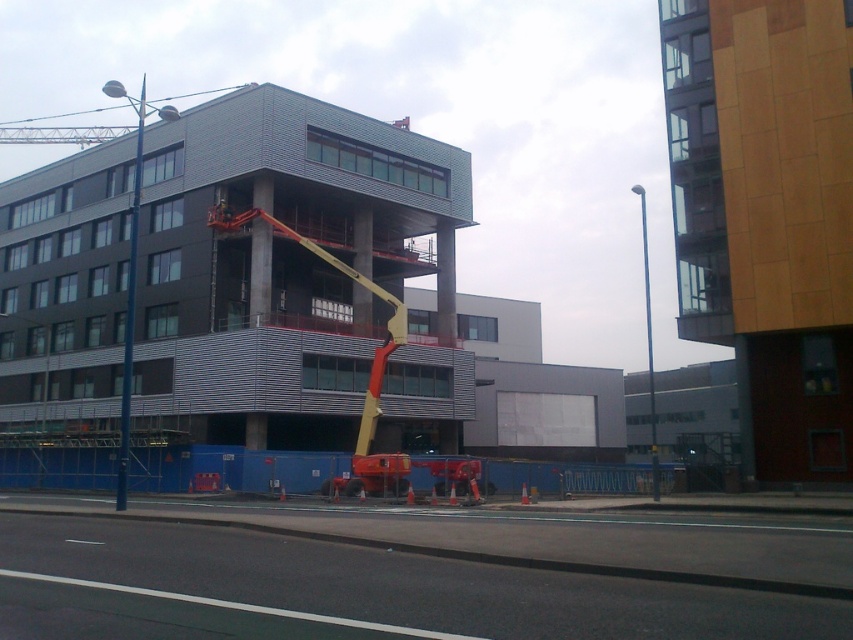
You are a delivery person approaching the construction site. You need to navigate around the orange traffic cones. There are two points marked on the map as point 1 at coordinates (138, 128) and point 2 at coordinates (119, 129). Which point should you avoid to stay safe and follow the path designated by the cones?

You should avoid point 2 at coordinates (119, 129) because point 1 at coordinates (138, 128) is in front of it, indicating that the path is blocked beyond point 2.

You are a delivery person trying to navigate through the construction site. You need to pass between the blue metallic pole at left and the metallic yellow crane at upper center. Can your 1.2 meter wide delivery cart fit through the space between them?

The blue metallic pole at left is narrower than the metallic yellow crane at upper center, but the question is about the space between them. Since the description only states their widths relative to each other, not the distance between them, we cannot determine if the 1.2 meter wide cart can fit. More information about the gap between the pole and crane is needed.